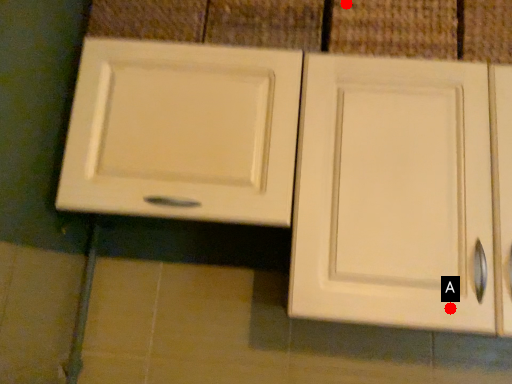
Question: Two points are circled on the image, labeled by A and B beside each circle. Which point is closer to the camera?

Choices:
 (A) A is closer
 (B) B is closer

Answer: (A)